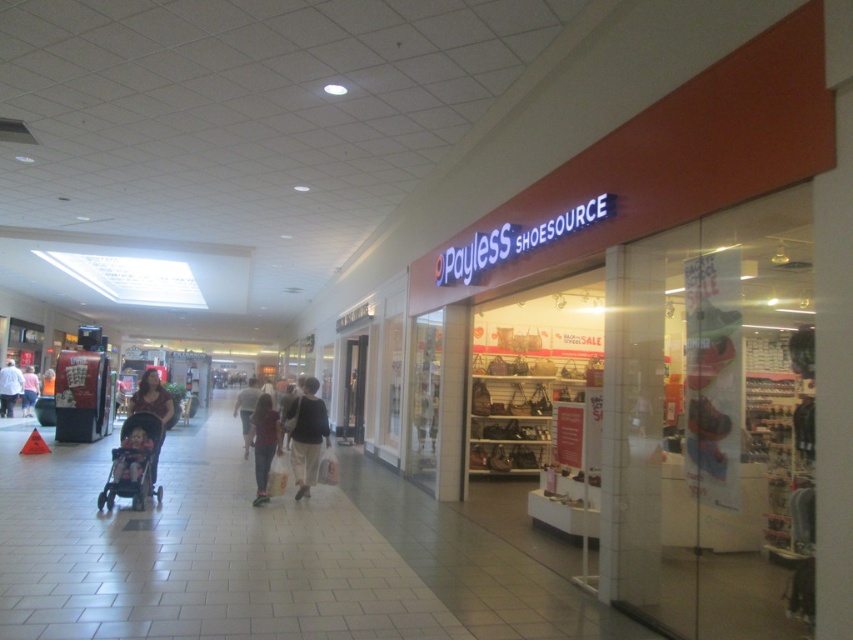
You are a customer in the mall and see a silver metallic stroller at left and a white cotton shirt at center. Which object is positioned to the right side of the other?

The silver metallic stroller at left is to the right of the white cotton shirt at center.

You are trying to decide which jacket to take from the store. The dark gray fabric jacket at center and the light brown leather jacket at center are both on display. Which jacket is smaller in size?

The dark gray fabric jacket at center is smaller than the light brown leather jacket at center, so the dark gray fabric jacket at center is the smaller one.

You are a customer in the mall holding a measuring tape. You see a white cotton shirt at center and a matte pink shirt at center. How far apart are these two shirts?

The white cotton shirt at center and the matte pink shirt at center are 17.54 inches apart from each other.